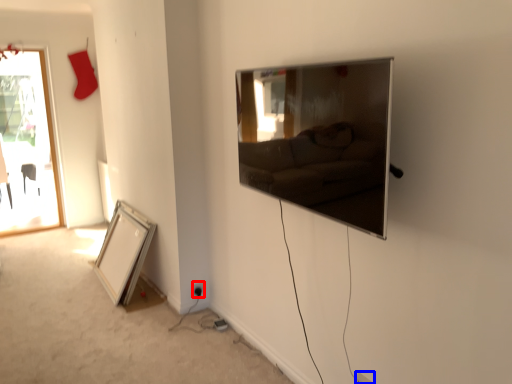
Question: Which object is further to the camera taking this photo, electric outlet (highlighted by a red box) or electric outlet (highlighted by a blue box)?

Choices:
 (A) electric outlet
 (B) electric outlet

Answer: (A)